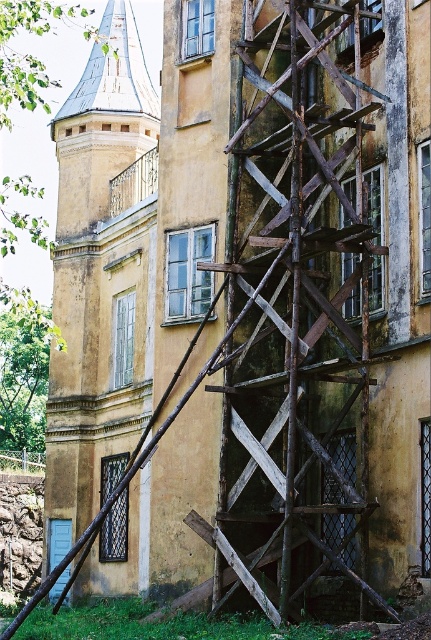
You are a construction worker standing at the base of the building. You need to access both the rusty wood scaffolding at center and the matte yellow tower at center. Which structure should you approach first to reach the one farther away without passing the other?

You should first approach the rusty wood scaffolding at center since it is closer to you, allowing you to then move towards the matte yellow tower at center which is farther away.

You are a construction worker standing at the entrance of the building. You need to place a tool box on the rusty wood scaffolding at center. Where exactly should you place it?

The rusty wood scaffolding at center is located at point (x=297, y=310), so you should place the tool box there.

You are an architect inspecting a historic building. You notice the rusty wood scaffolding at center and the matte yellow tower at center. Based on their positions, which object is closer to the building?

The rusty wood scaffolding at center is positioned on the right side of the matte yellow tower at center, so the matte yellow tower at center is closer to the building than the scaffolding.